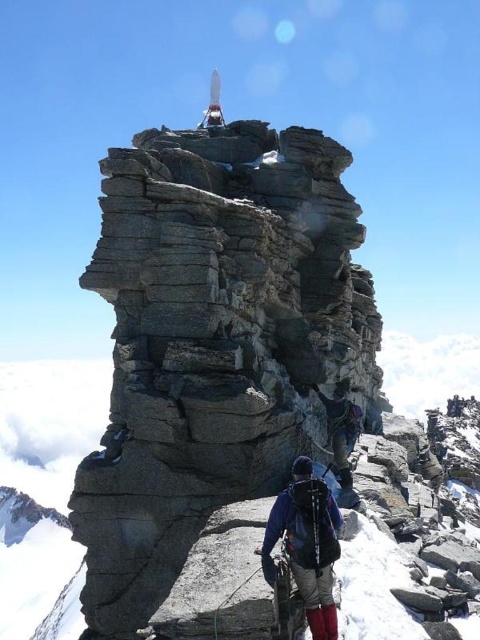
Question: Which point appears closest to the camera in this image?

Choices:
 (A) (337, 435)
 (B) (154, 296)

Answer: (B)

Question: Can you confirm if gray rough rock at center is positioned to the left of dark blue fabric backpack at center?

Choices:
 (A) yes
 (B) no

Answer: (A)

Question: Is matte blue jacket at center above dark blue fabric backpack at center?

Choices:
 (A) yes
 (B) no

Answer: (B)

Question: Can you confirm if gray rough rock at center is positioned to the left of dark blue fabric backpack at center?

Choices:
 (A) yes
 (B) no

Answer: (A)

Question: Among these points, which one is nearest to the camera?

Choices:
 (A) (292, 534)
 (B) (159, 173)
 (C) (336, 451)

Answer: (A)

Question: Which object is closer to the camera taking this photo?

Choices:
 (A) matte blue jacket at center
 (B) gray rough rock at center
 (C) dark blue fabric backpack at center

Answer: (A)